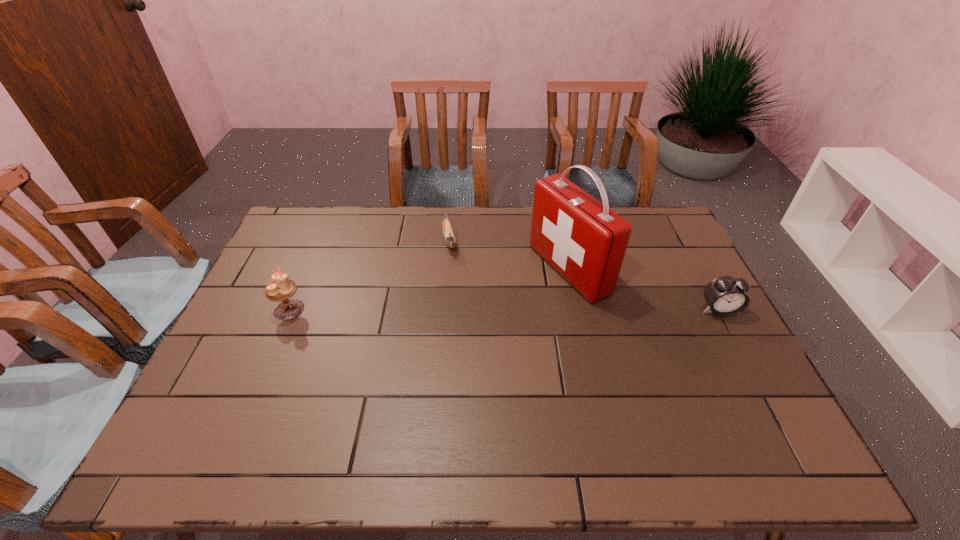
Find the location of a particular element. This screenshot has height=540, width=960. vacant region located at the stem of the banana is located at coordinates (458, 295).

Find the location of `free space located at the stem of the banana`. free space located at the stem of the banana is located at coordinates (456, 288).

The height and width of the screenshot is (540, 960). I want to click on free space located at the stem of the banana, so click(x=459, y=302).

Locate an element on the screen. This screenshot has height=540, width=960. free space located on the front face of the second object from right to left is located at coordinates (481, 312).

The image size is (960, 540). Identify the location of vacant point located on the front face of the second object from right to left. [x=438, y=331].

At what (x,y) coordinates should I click in order to perform the action: click on vacant space located 0.080m on the front face of the second object from right to left. Please return your answer as a coordinate pair (x, y). This screenshot has height=540, width=960. Looking at the image, I should click on (518, 296).

This screenshot has width=960, height=540. Identify the location of banana that is at the far edge. (449, 236).

At what (x,y) coordinates should I click in order to perform the action: click on the first-aid kit situated at the far edge. Please return your answer as a coordinate pair (x, y). Image resolution: width=960 pixels, height=540 pixels. Looking at the image, I should click on (582, 239).

Find the location of a particular element. The height and width of the screenshot is (540, 960). object that is at the left edge is located at coordinates (283, 288).

Where is `object located at the right edge`? Image resolution: width=960 pixels, height=540 pixels. object located at the right edge is located at coordinates (726, 296).